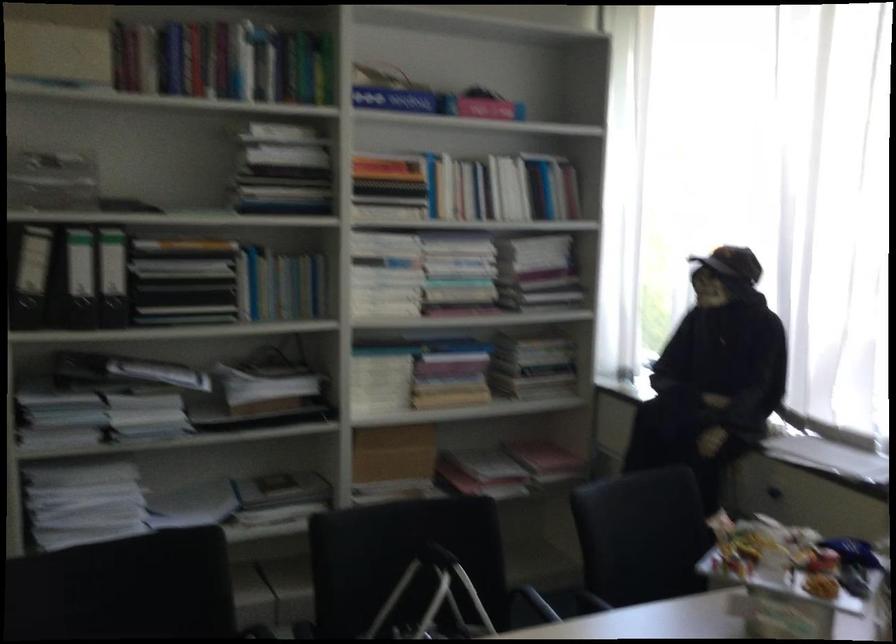
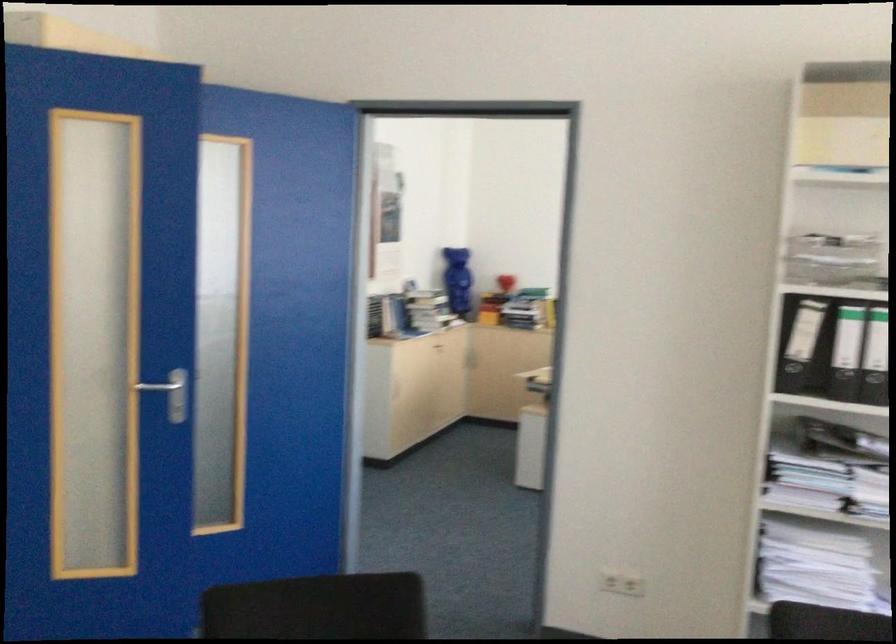
Question: The camera is either moving clockwise (left) or counter-clockwise (right) around the object. The first image is from the beginning of the video and the second image is from the end. Is the camera moving left or right when shooting the video?

Choices:
 (A) Left
 (B) Right

Answer: (B)